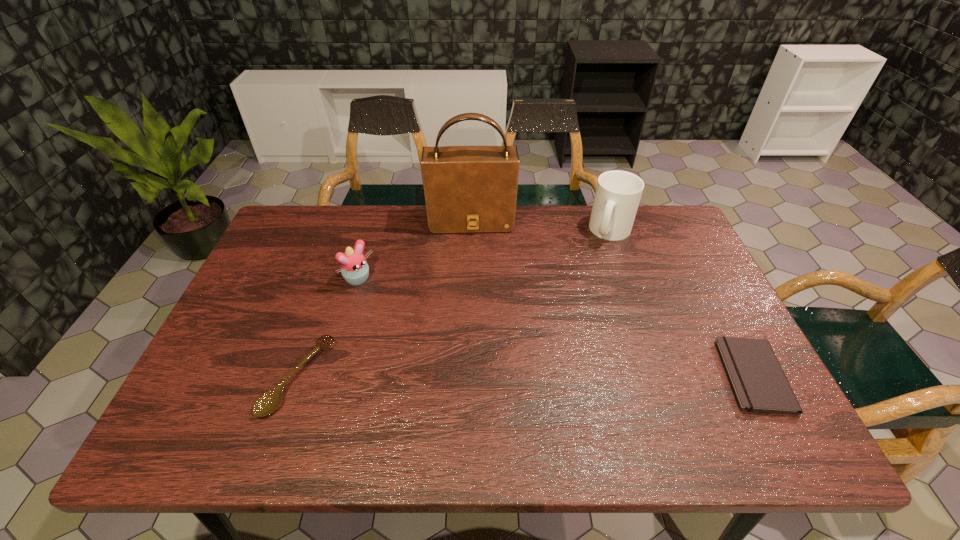
The width and height of the screenshot is (960, 540). Identify the location of vacant space at the left edge of the desktop. [283, 267].

In order to click on free location at the far left corner in this screenshot , I will do `click(298, 211)`.

In order to click on free region at the near left corner in this screenshot , I will do `click(197, 409)`.

You are a GUI agent. You are given a task and a screenshot of the screen. Output one action in this format:
    pyautogui.click(x=<x>, y=<y>)
    Task: Click on the free space at the near right corner of the desktop
    
    Given the screenshot: What is the action you would take?
    pyautogui.click(x=720, y=377)

I want to click on free spot between the checkbook and the fourth object from left to right, so click(x=683, y=303).

You are a GUI agent. You are given a task and a screenshot of the screen. Output one action in this format:
    pyautogui.click(x=<x>, y=<y>)
    Task: Click on the free space between the fourth shortest object and the checkbook
    This screenshot has width=960, height=540.
    Given the screenshot: What is the action you would take?
    pyautogui.click(x=683, y=303)

You are a GUI agent. You are given a task and a screenshot of the screen. Output one action in this format:
    pyautogui.click(x=<x>, y=<y>)
    Task: Click on the vacant point located between the cupcake and the second shortest object
    
    Given the screenshot: What is the action you would take?
    pyautogui.click(x=328, y=329)

Find the location of `vacant area that lies between the ladle and the tallest object`. vacant area that lies between the ladle and the tallest object is located at coordinates (385, 299).

I want to click on vacant area that lies between the ladle and the fourth shortest object, so click(454, 304).

This screenshot has height=540, width=960. In order to click on free space that is in between the third object from right to left and the third shortest object in this screenshot , I will do pos(415,251).